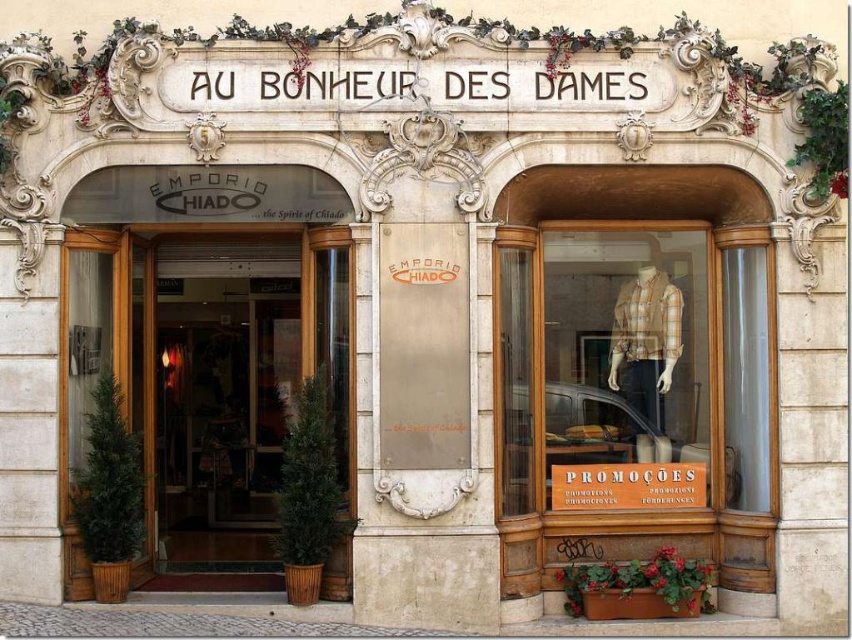
You are standing in front of the shop entrance of Au Bonheur des Dames. You want to place a new decorative item at point (634, 365). What is currently located at that point?

At point (634, 365) lies wooden mannequin at center.

You are standing in front of the shop entrance of Au Bonheur des Dames. There are two points marked on the facade. One is at coordinate point (x=608, y=388) and the other is at point (x=340, y=397). Which point is closer to you?

Point (x=608, y=388) is closer to you because it is further to the viewer than point (x=340, y=397).